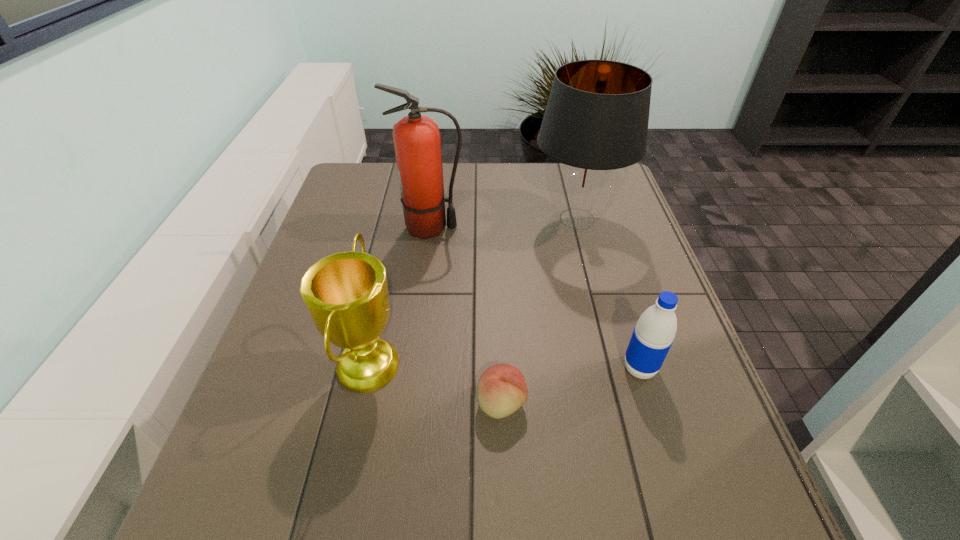
At what (x,y) coordinates should I click in order to perform the action: click on vacant space that satisfies the following two spatial constraints: 1. on the nozzle of the water bottle; 2. on the right side of the fire extinguisher. Please return your answer as a coordinate pair (x, y). Image resolution: width=960 pixels, height=540 pixels. Looking at the image, I should click on (412, 368).

You are a GUI agent. You are given a task and a screenshot of the screen. Output one action in this format:
    pyautogui.click(x=<x>, y=<y>)
    Task: Click on the free space that satisfies the following two spatial constraints: 1. on the front side of the lampshade; 2. on the right side of the water bottle
    The height and width of the screenshot is (540, 960).
    Given the screenshot: What is the action you would take?
    pyautogui.click(x=616, y=368)